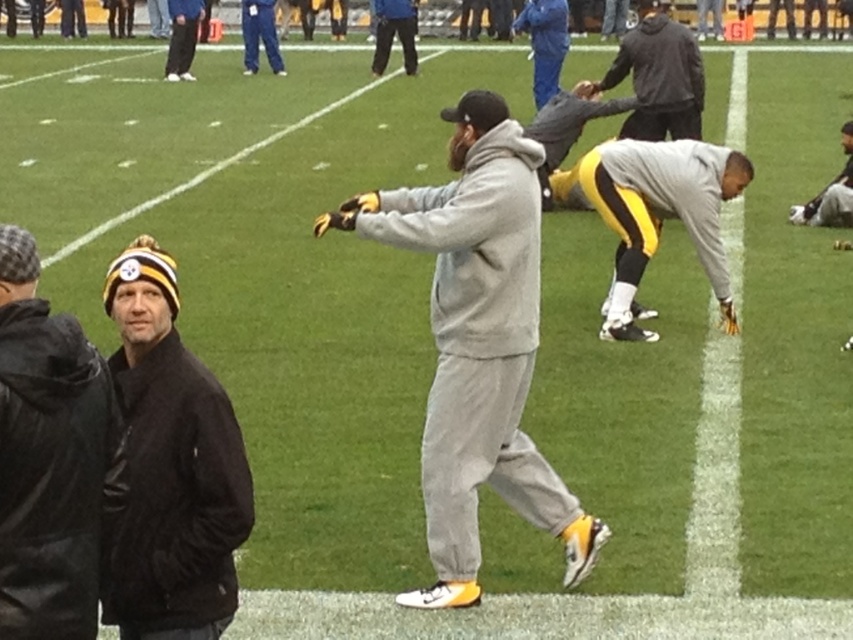
You are standing on the football field and see two points marked on the field. The first point is at coordinates point (149, 566) and the second point is at point (614, 140). Which point is closer to you?

Point (149, 566) is closer to the viewer than point (614, 140).

You are a photographer positioned at the center of the football field. You need to capture a photo where both the black leather jacket at left and the blue jeans at upper center are visible. Based on their positions, which object is closer to the camera?

The black leather jacket at left has a lesser height compared to blue jeans at upper center, which indicates it is closer to the camera.